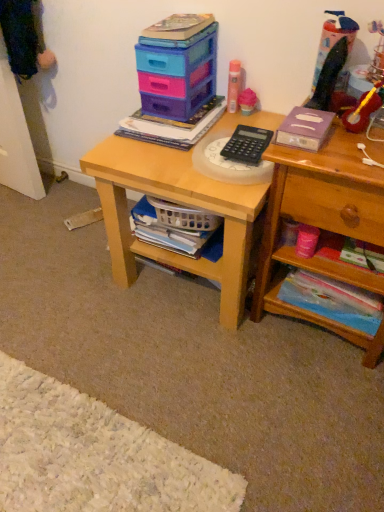
Where is `vacant space that is in between wooden at right and light wood desk at center`? The height and width of the screenshot is (512, 384). vacant space that is in between wooden at right and light wood desk at center is located at coordinates (278, 346).